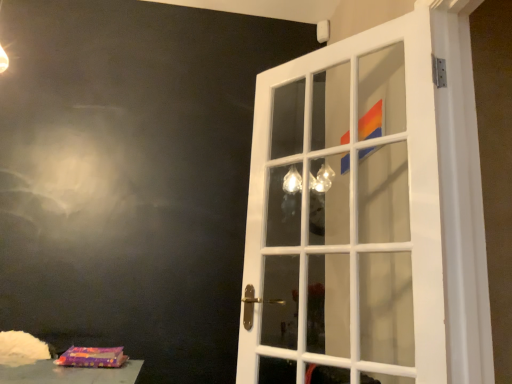
This screenshot has width=512, height=384. What do you see at coordinates (347, 213) in the screenshot?
I see `white glass door at center` at bounding box center [347, 213].

From the picture: Measure the distance between white glass door at center and camera.

A distance of 3.81 feet exists between white glass door at center and camera.

The width and height of the screenshot is (512, 384). Identify the location of white glass door at center. (347, 213).

What is the approximate width of purple fabric bag at lower left?

It is 6.04 inches.

In order to click on purple fabric bag at lower left in this screenshot , I will do `click(92, 357)`.

Describe the element at coordinates (92, 357) in the screenshot. I see `purple fabric bag at lower left` at that location.

Locate an element on the screen. The width and height of the screenshot is (512, 384). white glass door at center is located at coordinates (347, 213).

Consider the image. Which object is positioned more to the left, white glass door at center or purple fabric bag at lower left?

From the viewer's perspective, purple fabric bag at lower left appears more on the left side.

Considering their positions, is white glass door at center located in front of or behind purple fabric bag at lower left?

In the image, white glass door at center appears in front of purple fabric bag at lower left.

Considering the positions of points (388, 341) and (79, 359), is point (388, 341) closer to camera compared to point (79, 359)?

No, it is behind (79, 359).

From the image's perspective, which is above, white glass door at center or purple fabric bag at lower left?

From the image's view, white glass door at center is above.

From a real-world perspective, is white glass door at center above or below purple fabric bag at lower left?

white glass door at center is situated higher than purple fabric bag at lower left in the real world.

Considering the sizes of objects white glass door at center and purple fabric bag at lower left in the image provided, who is wider, white glass door at center or purple fabric bag at lower left?

white glass door at center.

Which of these two, white glass door at center or purple fabric bag at lower left, stands taller?

white glass door at center is taller.

Considering the sizes of objects white glass door at center and purple fabric bag at lower left in the image provided, who is bigger, white glass door at center or purple fabric bag at lower left?

white glass door at center.

Choose the correct answer: Is white glass door at center inside purple fabric bag at lower left or outside it?

white glass door at center cannot be found inside purple fabric bag at lower left.

Is the surface of white glass door at center in direct contact with purple fabric bag at lower left?

There is a gap between white glass door at center and purple fabric bag at lower left.

Is white glass door at center oriented towards purple fabric bag at lower left?

No, white glass door at center is not turned towards purple fabric bag at lower left.

Can you tell me how much white glass door at center and purple fabric bag at lower left differ in facing direction?

The angle between the facing direction of white glass door at center and the facing direction of purple fabric bag at lower left is 46 degrees.

In the image, there is a white glass door at center. Identify the location of package below it (from a real-world perspective). pyautogui.click(x=92, y=357).

Which is more to the right, purple fabric bag at lower left or white glass door at center?

white glass door at center is more to the right.

Relative to white glass door at center, is purple fabric bag at lower left in front or behind?

Visually, purple fabric bag at lower left is located behind white glass door at center.

Is point (62, 356) positioned in front of point (395, 94)?

Yes, point (62, 356) is closer to viewer.

From the image's perspective, is purple fabric bag at lower left above or below white glass door at center?

Based on their image positions, purple fabric bag at lower left is located beneath white glass door at center.

From a real-world perspective, which is physically below, purple fabric bag at lower left or white glass door at center?

purple fabric bag at lower left, from a real-world perspective.

Considering the sizes of purple fabric bag at lower left and white glass door at center in the image, is purple fabric bag at lower left wider or thinner than white glass door at center?

purple fabric bag at lower left is thinner than white glass door at center.

Considering the relative sizes of purple fabric bag at lower left and white glass door at center in the image provided, is purple fabric bag at lower left taller than white glass door at center?

No, purple fabric bag at lower left is not taller than white glass door at center.

Is purple fabric bag at lower left bigger than white glass door at center?

Actually, purple fabric bag at lower left might be smaller than white glass door at center.

Would you say white glass door at center is part of purple fabric bag at lower left's contents?

No, purple fabric bag at lower left does not contain white glass door at center.

Consider the image. Would you say purple fabric bag at lower left is a long distance from white glass door at center?

Yes.

In the scene shown: Is purple fabric bag at lower left looking in the opposite direction of white glass door at center?

No, purple fabric bag at lower left is not facing away from white glass door at center.

Image resolution: width=512 pixels, height=384 pixels. What are the coordinates of `package behind the white glass door at center` in the screenshot? It's located at (92, 357).

I want to click on package directly beneath the white glass door at center (from a real-world perspective), so click(92, 357).

Where is `door that appears above the purple fabric bag at lower left (from a real-world perspective)`? door that appears above the purple fabric bag at lower left (from a real-world perspective) is located at coordinates (347, 213).